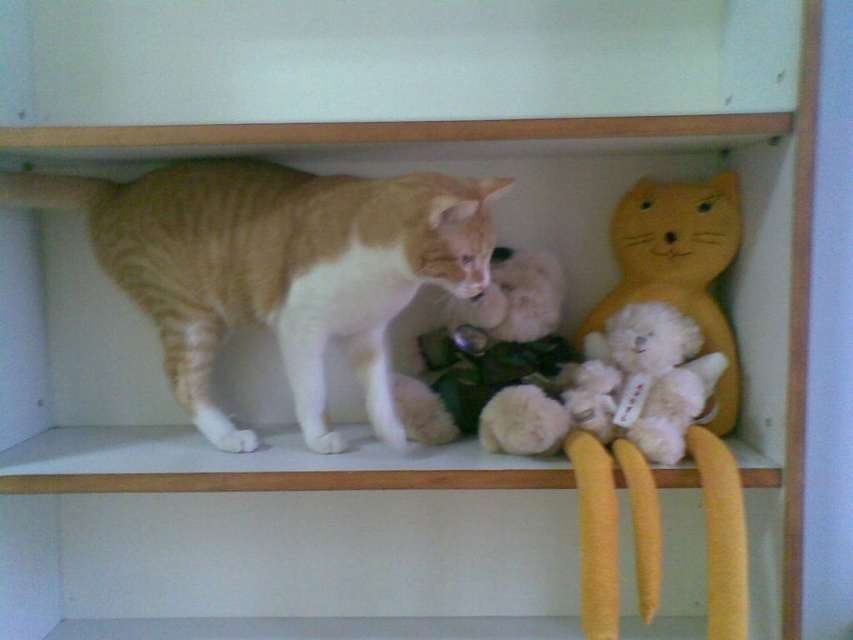
Can you confirm if orange tabby cat at left is thinner than yellow plush cat at right?

In fact, orange tabby cat at left might be wider than yellow plush cat at right.

Does orange tabby cat at left appear over yellow plush cat at right?

Correct, orange tabby cat at left is located above yellow plush cat at right.

Identify the location of orange tabby cat at left. (277, 268).

Which is more to the left, yellow plush cat at right or fluffy white teddy bear at right?

fluffy white teddy bear at right

Does yellow plush cat at right appear under fluffy white teddy bear at right?

Actually, yellow plush cat at right is above fluffy white teddy bear at right.

I want to click on yellow plush cat at right, so click(679, 268).

Which is more to the right, orange tabby cat at left or fluffy white teddy bear at center?

fluffy white teddy bear at center

Is point (309, 272) closer to camera compared to point (432, 365)?

Yes.

Locate an element on the screen. This screenshot has width=853, height=640. orange tabby cat at left is located at coordinates (277, 268).